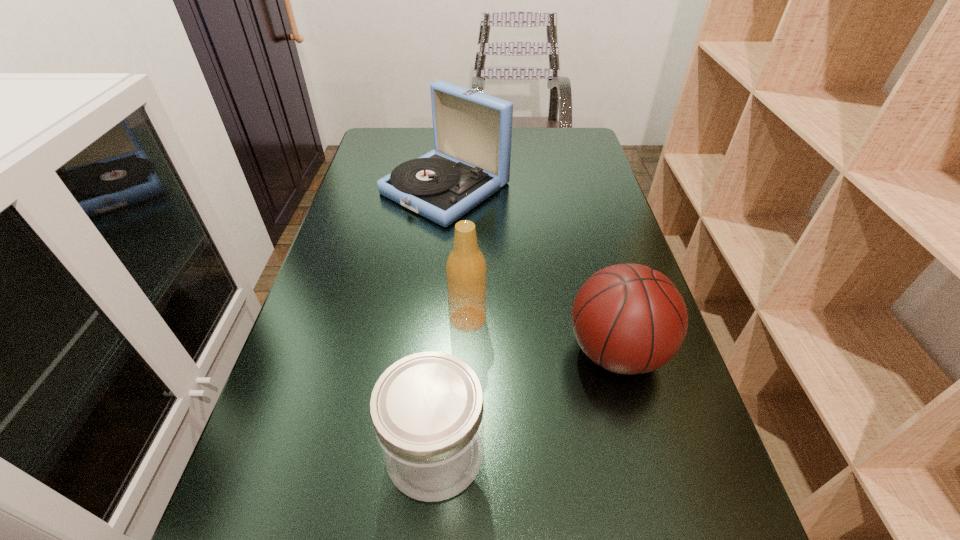
I want to click on phonograph record, so click(x=472, y=131).

This screenshot has width=960, height=540. I want to click on beer bottle, so click(466, 269).

This screenshot has height=540, width=960. In order to click on the rightmost object in this screenshot , I will do `click(630, 319)`.

Locate an element on the screen. This screenshot has width=960, height=540. the second shortest object is located at coordinates (630, 319).

Find the location of `the shortest object`. the shortest object is located at coordinates (427, 409).

Identify the location of jar. Image resolution: width=960 pixels, height=540 pixels. (427, 409).

At what (x,y) coordinates should I click in order to perform the action: click on vacant position located 0.080m on the back of the farthest object. Please return your answer as a coordinate pair (x, y). Looking at the image, I should click on (450, 145).

At what (x,y) coordinates should I click in order to perform the action: click on vacant position located on the right of the beer bottle. Please return your answer as a coordinate pair (x, y). The width and height of the screenshot is (960, 540). Looking at the image, I should click on (566, 319).

Locate an element on the screen. free space located on the front of the rightmost object is located at coordinates (641, 444).

Identify the location of vacant space located on the back of the shortest object. The width and height of the screenshot is (960, 540). [x=441, y=375].